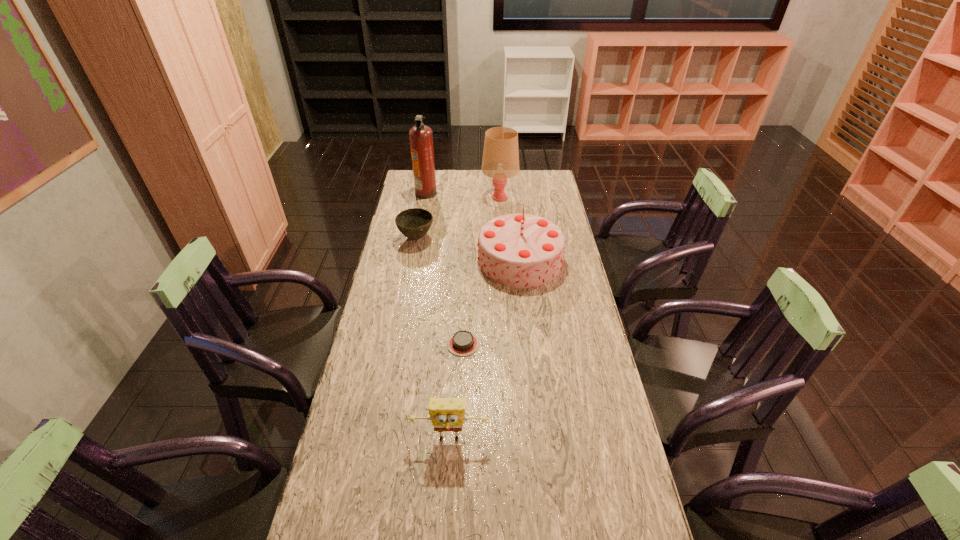
Identify the location of vacant region located 0.350m on the left of the birthday cake. The image size is (960, 540). (390, 260).

The image size is (960, 540). Find the location of `free space located 0.160m on the face of the sponge`. free space located 0.160m on the face of the sponge is located at coordinates (445, 517).

Locate an element on the screen. This screenshot has width=960, height=540. vacant point located on the front of the second shortest object is located at coordinates (404, 302).

Locate an element on the screen. The image size is (960, 540). free location located 0.310m on the back of the shortest object is located at coordinates (466, 271).

This screenshot has height=540, width=960. What are the coordinates of `fire extinguisher situated at the far edge` in the screenshot? It's located at (421, 138).

Where is `lampshade at the far edge`? The image size is (960, 540). lampshade at the far edge is located at coordinates (500, 161).

In order to click on fire extinguisher located at the left edge in this screenshot , I will do [421, 138].

Identify the location of bowl present at the left edge. Image resolution: width=960 pixels, height=540 pixels. (414, 223).

Find the location of `object situated at the right edge`. object situated at the right edge is located at coordinates (520, 250).

What are the coordinates of `object that is at the far left corner` in the screenshot? It's located at (421, 138).